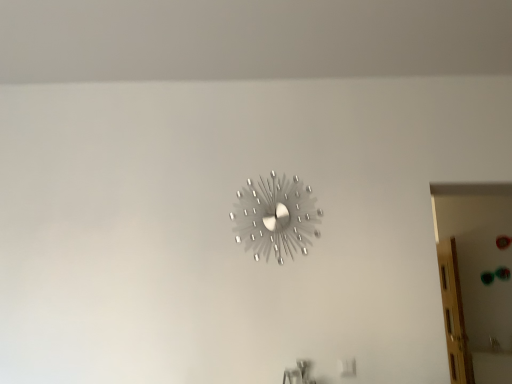
The width and height of the screenshot is (512, 384). What do you see at coordinates (454, 314) in the screenshot?
I see `translucent wood door at right` at bounding box center [454, 314].

At what (x,y) coordinates should I click in order to perform the action: click on translucent wood door at right. Please return your answer as a coordinate pair (x, y). The width and height of the screenshot is (512, 384). Looking at the image, I should click on (454, 314).

Locate an element on the screen. metallic silver wall clock at center is located at coordinates (275, 217).

The width and height of the screenshot is (512, 384). Describe the element at coordinates (275, 217) in the screenshot. I see `metallic silver wall clock at center` at that location.

Identify the location of translucent wood door at right. The height and width of the screenshot is (384, 512). (x=454, y=314).

Which object is positioned more to the right, translucent wood door at right or metallic silver wall clock at center?

Positioned to the right is translucent wood door at right.

Which object is further away from the camera taking this photo, translucent wood door at right or metallic silver wall clock at center?

translucent wood door at right is behind.

Is point (456, 302) in front of point (294, 177)?

No, (456, 302) is behind (294, 177).

From the image's perspective, is translucent wood door at right under metallic silver wall clock at center?

Yes.

From a real-world perspective, is translucent wood door at right positioned under metallic silver wall clock at center based on gravity?

Indeed, from a real-world perspective, translucent wood door at right is positioned beneath metallic silver wall clock at center.

In the scene shown: Considering the relative sizes of translucent wood door at right and metallic silver wall clock at center in the image provided, is translucent wood door at right wider than metallic silver wall clock at center?

Indeed, translucent wood door at right has a greater width compared to metallic silver wall clock at center.

Considering the relative sizes of translucent wood door at right and metallic silver wall clock at center in the image provided, is translucent wood door at right shorter than metallic silver wall clock at center?

In fact, translucent wood door at right may be taller than metallic silver wall clock at center.

Considering the sizes of objects translucent wood door at right and metallic silver wall clock at center in the image provided, who is smaller, translucent wood door at right or metallic silver wall clock at center?

metallic silver wall clock at center is smaller.

Would you say translucent wood door at right is inside or outside metallic silver wall clock at center?

translucent wood door at right exists outside the volume of metallic silver wall clock at center.

Are translucent wood door at right and metallic silver wall clock at center located far from each other?

Yes.

Is translucent wood door at right turned away from metallic silver wall clock at center?

No, translucent wood door at right is not facing away from metallic silver wall clock at center.

Where is `glass door below the metallic silver wall clock at center (from a real-world perspective)`? The width and height of the screenshot is (512, 384). glass door below the metallic silver wall clock at center (from a real-world perspective) is located at coordinates pos(454,314).

Between metallic silver wall clock at center and translucent wood door at right, which one appears on the left side from the viewer's perspective?

metallic silver wall clock at center is more to the left.

Is metallic silver wall clock at center in front of or behind translucent wood door at right in the image?

metallic silver wall clock at center is positioned closer to the viewer than translucent wood door at right.

Between point (265, 212) and point (455, 288), which one is positioned behind?

The point (455, 288) is more distant.

From the image's perspective, is metallic silver wall clock at center on top of translucent wood door at right?

Yes, from the image's perspective, metallic silver wall clock at center is over translucent wood door at right.

From a real-world perspective, is metallic silver wall clock at center positioned over translucent wood door at right based on gravity?

Yes, from a real-world perspective, metallic silver wall clock at center is on top of translucent wood door at right.

Considering the relative sizes of metallic silver wall clock at center and translucent wood door at right in the image provided, is metallic silver wall clock at center thinner than translucent wood door at right?

Yes.

Can you confirm if metallic silver wall clock at center is taller than translucent wood door at right?

No.

Between metallic silver wall clock at center and translucent wood door at right, which one has larger size?

translucent wood door at right is bigger.

Is translucent wood door at right completely or partially inside metallic silver wall clock at center?

Actually, translucent wood door at right is outside metallic silver wall clock at center.

Is metallic silver wall clock at center not close to translucent wood door at right?

Yes, metallic silver wall clock at center is far from translucent wood door at right.

Is metallic silver wall clock at center looking in the opposite direction of translucent wood door at right?

metallic silver wall clock at center is not turned away from translucent wood door at right.

What's the angular difference between metallic silver wall clock at center and translucent wood door at right's facing directions?

The angular difference between metallic silver wall clock at center and translucent wood door at right is 93.9 degrees.

Where is `wall clock above the translucent wood door at right (from a real-world perspective)`? wall clock above the translucent wood door at right (from a real-world perspective) is located at coordinates (275, 217).

The height and width of the screenshot is (384, 512). I want to click on glass door below the metallic silver wall clock at center (from a real-world perspective), so click(x=454, y=314).

The width and height of the screenshot is (512, 384). Find the location of `wall clock above the translucent wood door at right (from a real-world perspective)`. wall clock above the translucent wood door at right (from a real-world perspective) is located at coordinates (275, 217).